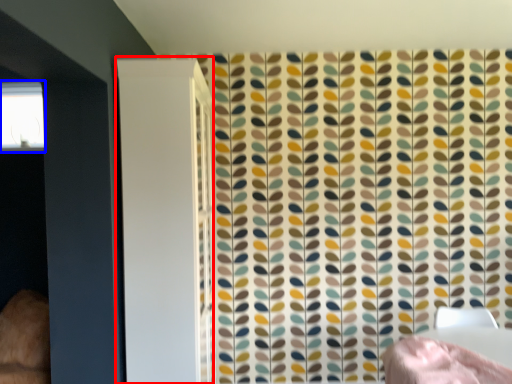
Question: Which of the following is the farthest to the observer, screen door (highlighted by a red box) or window (highlighted by a blue box)?

Choices:
 (A) screen door
 (B) window

Answer: (B)